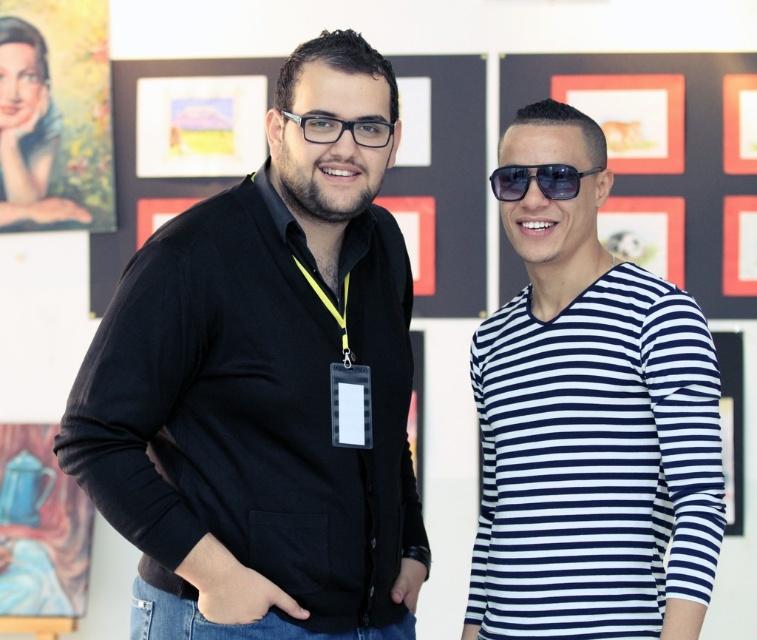
Question: Can you confirm if white striped shirt at right is thinner than sunglasses at center?

Choices:
 (A) yes
 (B) no

Answer: (B)

Question: Which object appears farthest from the camera in this image?

Choices:
 (A) transparent plastic glasses at center
 (B) white striped shirt at right

Answer: (A)

Question: Does sunglasses at center have a greater width compared to transparent plastic glasses at center?

Choices:
 (A) no
 (B) yes

Answer: (B)

Question: Which point is farther to the camera?

Choices:
 (A) (217, 250)
 (B) (301, 124)

Answer: (B)

Question: Is black matte cardigan at left above sunglasses at center?

Choices:
 (A) no
 (B) yes

Answer: (A)

Question: Which object is positioned closest to the white striped shirt at right?

Choices:
 (A) transparent plastic glasses at center
 (B) black matte cardigan at left
 (C) sunglasses at center

Answer: (C)